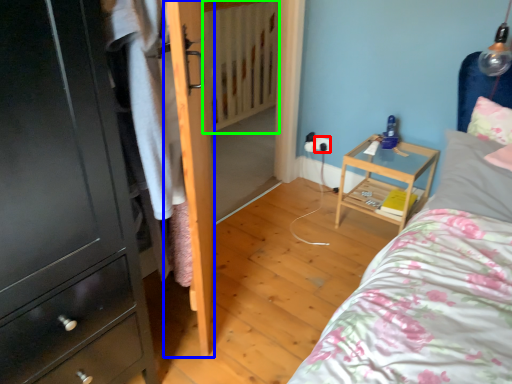
Question: Which is farther away from electric outlet (highlighted by a red box)? door (highlighted by a blue box) or radiator (highlighted by a green box)?

Choices:
 (A) door
 (B) radiator

Answer: (A)